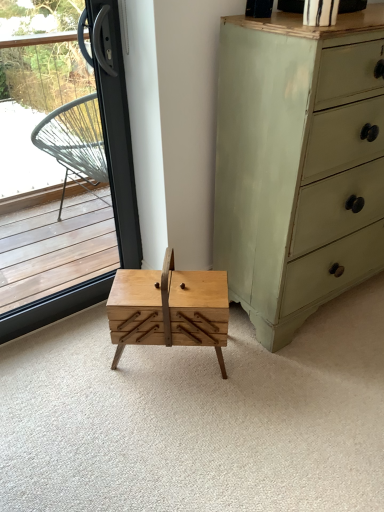
Question: Is natural wood drawer at center shorter than transparent glass window at left?

Choices:
 (A) no
 (B) yes

Answer: (B)

Question: From a real-world perspective, is natural wood drawer at center located beneath transparent glass window at left?

Choices:
 (A) no
 (B) yes

Answer: (B)

Question: From the image's perspective, is natural wood drawer at center located beneath transparent glass window at left?

Choices:
 (A) no
 (B) yes

Answer: (B)

Question: From a real-world perspective, is natural wood drawer at center positioned over transparent glass window at left based on gravity?

Choices:
 (A) no
 (B) yes

Answer: (A)

Question: Considering the relative sizes of natural wood drawer at center and transparent glass window at left in the image provided, is natural wood drawer at center bigger than transparent glass window at left?

Choices:
 (A) yes
 (B) no

Answer: (A)

Question: Would you say natural wood drawer at center contains transparent glass window at left?

Choices:
 (A) no
 (B) yes

Answer: (A)

Question: Does natural wood table at center appear on the left side of natural wood drawer at center?

Choices:
 (A) no
 (B) yes

Answer: (B)

Question: Is natural wood table at center positioned before natural wood drawer at center?

Choices:
 (A) no
 (B) yes

Answer: (A)

Question: Considering the relative sizes of natural wood table at center and natural wood drawer at center in the image provided, is natural wood table at center thinner than natural wood drawer at center?

Choices:
 (A) no
 (B) yes

Answer: (B)

Question: Is natural wood table at center positioned behind natural wood drawer at center?

Choices:
 (A) yes
 (B) no

Answer: (A)

Question: Would you say natural wood table at center contains natural wood drawer at center?

Choices:
 (A) yes
 (B) no

Answer: (B)

Question: Is natural wood table at center wider than natural wood drawer at center?

Choices:
 (A) no
 (B) yes

Answer: (A)

Question: Is light green painted wood chest of drawers at right looking in the opposite direction of natural wood drawer at center?

Choices:
 (A) no
 (B) yes

Answer: (A)